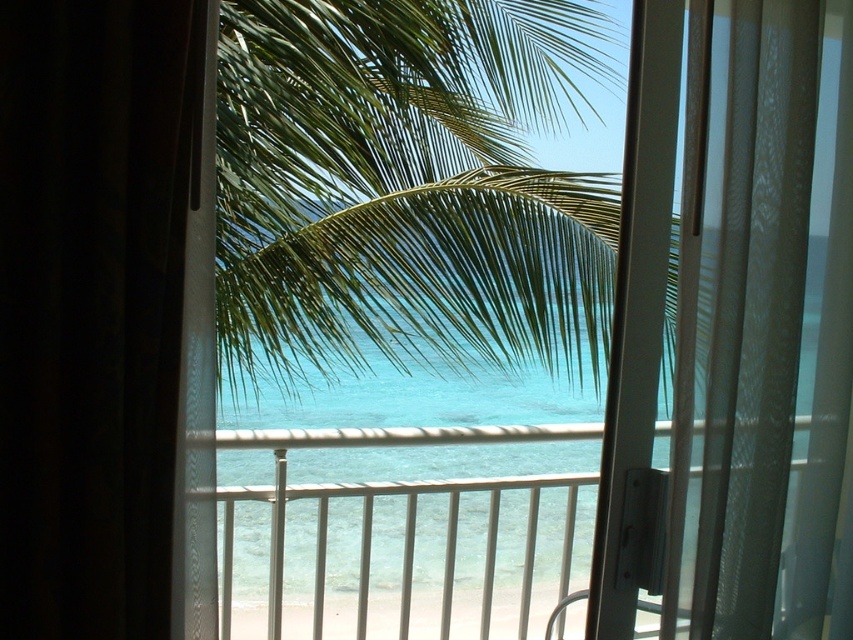
Is green leafy palm tree at center to the left of black sheer curtain at left from the viewer's perspective?

No, green leafy palm tree at center is not to the left of black sheer curtain at left.

Locate an element on the screen. green leafy palm tree at center is located at coordinates (405, 189).